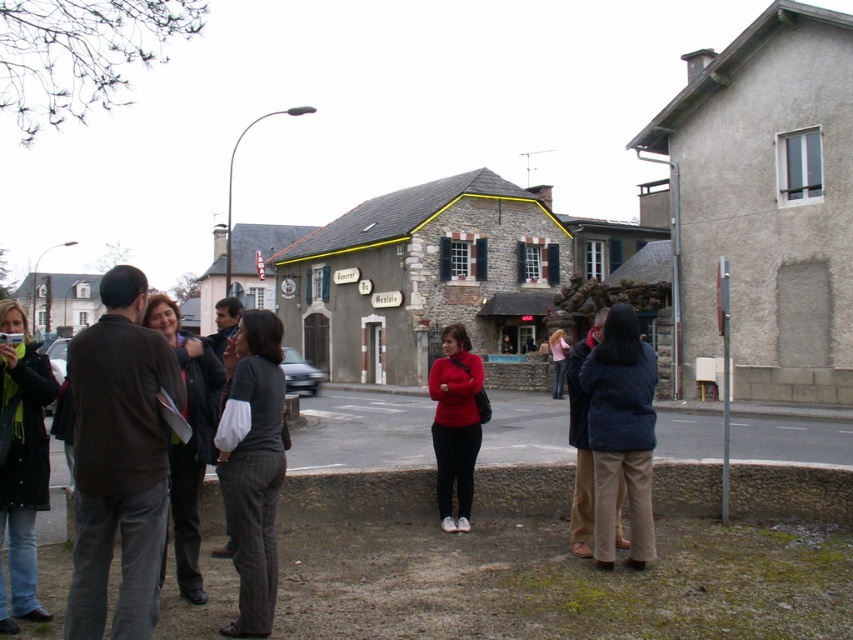
You are part of a group of people standing in the foreground of the scene. You notice two individuals wearing the blue quilted jacket at center and the dark gray sweater at center. From your perspective, which clothing item is located to the right of the other?

The blue quilted jacket at center is positioned on the right side of dark gray sweater at center, so the blue quilted jacket at center is to the right of the dark gray sweater at center.

Based on the provided scene description, what are the exact coordinates of the blue quilted jacket at center?

The blue quilted jacket at center is located at coordinates 0.680 and 0.729.

You are standing in the town square and see the dark brown jacket at left and the gray pinstripe pants at center. Which clothing item is nearer to you?

The dark brown jacket at left is closer to the viewer than the gray pinstripe pants at center.